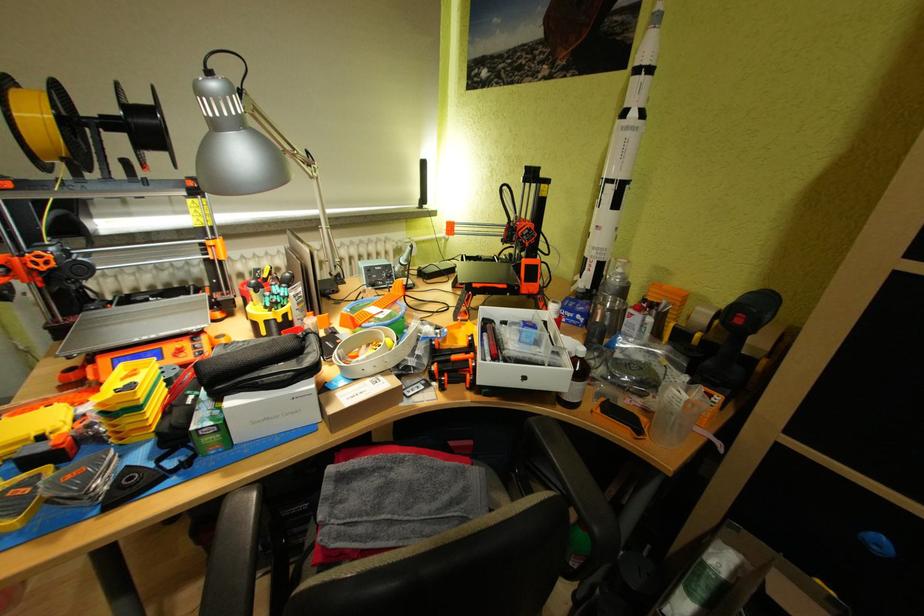
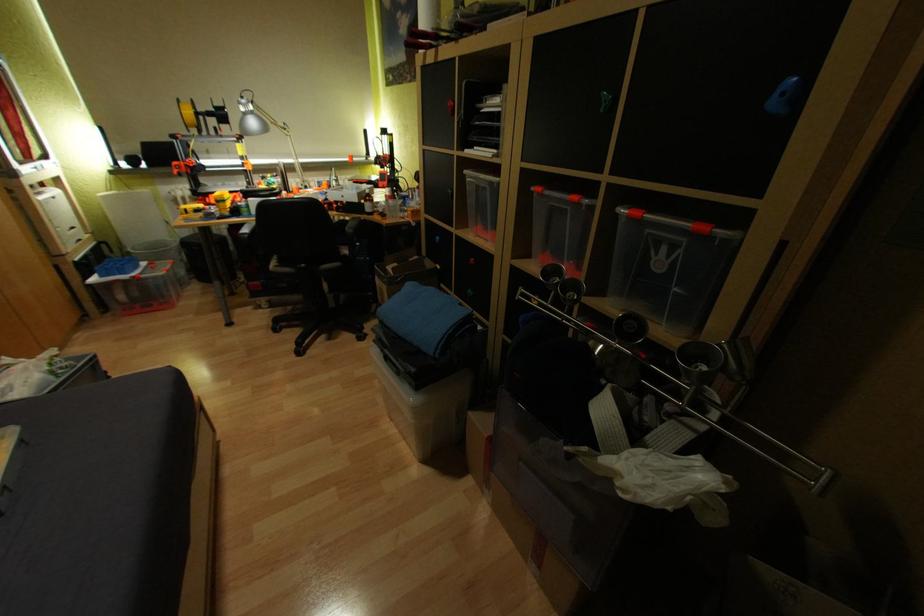
In a continuous first-person perspective shot, in which direction is the camera moving?

The cameraman moved toward right, backward.